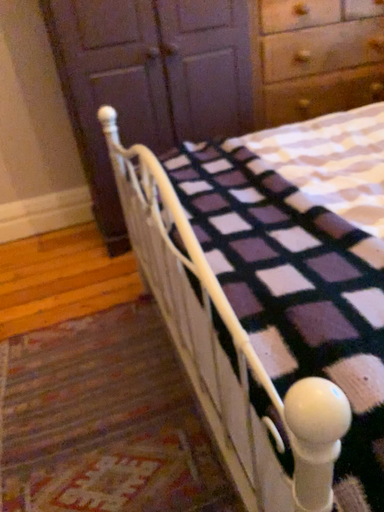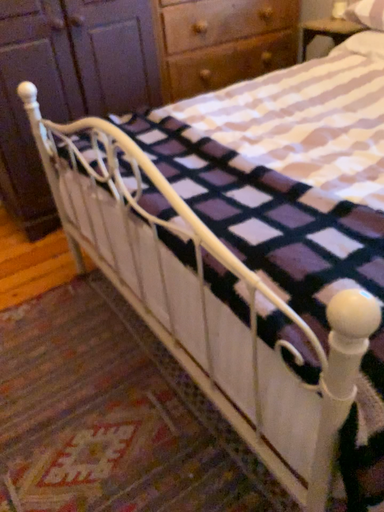
Question: How did the camera likely rotate when shooting the video?

Choices:
 (A) rotated right
 (B) rotated left

Answer: (A)